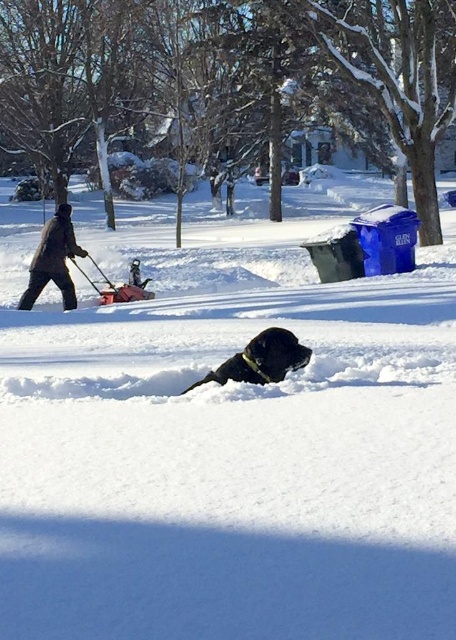
You are standing in the winter scene and see the white fluffy snow at center and the black matte dog at center. Which object is positioned to the left of the other?

The white fluffy snow at center is to the left of the black matte dog at center.

You are a photographer trying to capture a clear shot of the black matte dog at center and the dark brown jacket at left. Since the dog is closer to you, will the jacket be partially hidden behind the dog in the photo?

Yes, the black matte dog at center is in front of the dark brown jacket at left, so the jacket will be partially hidden behind the dog in the photo.

You are standing in the winter scene and want to walk from the dark brown jacket at left to the white fluffy snow at center. Which direction should you move to reach the snow?

You should move towards the white fluffy snow at center because it is closer to you than the dark brown jacket at left.